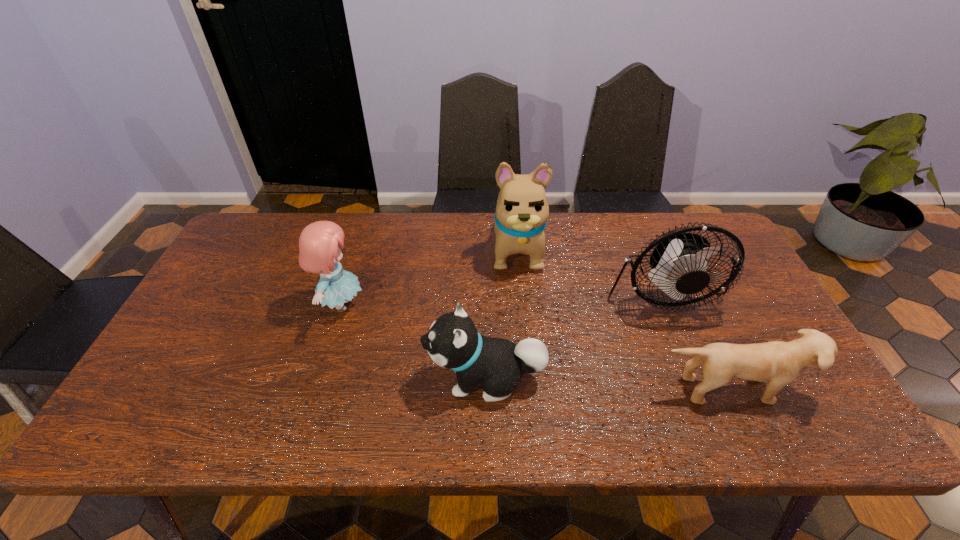
Find the location of a particular element. This screenshot has height=540, width=960. the tallest puppy is located at coordinates (522, 211).

This screenshot has height=540, width=960. In order to click on fan in this screenshot , I will do `click(679, 263)`.

This screenshot has height=540, width=960. I want to click on doll, so click(x=320, y=243).

Locate an element on the screen. The image size is (960, 540). the shortest puppy is located at coordinates (781, 362).

The image size is (960, 540). Identify the location of the rightmost puppy. (781, 362).

Locate an element on the screen. free location located 0.100m on the face of the farthest puppy is located at coordinates (522, 305).

At what (x,y) coordinates should I click in order to perform the action: click on free spot located 0.260m in front of the fan, directing airflow. Please return your answer as a coordinate pair (x, y). Looking at the image, I should click on (712, 413).

Find the location of `free location located on the front-facing side of the doll`. free location located on the front-facing side of the doll is located at coordinates (469, 305).

This screenshot has height=540, width=960. I want to click on free region located on the left side of the shortest object, so click(x=749, y=433).

Identify the location of object that is at the far edge. click(522, 211).